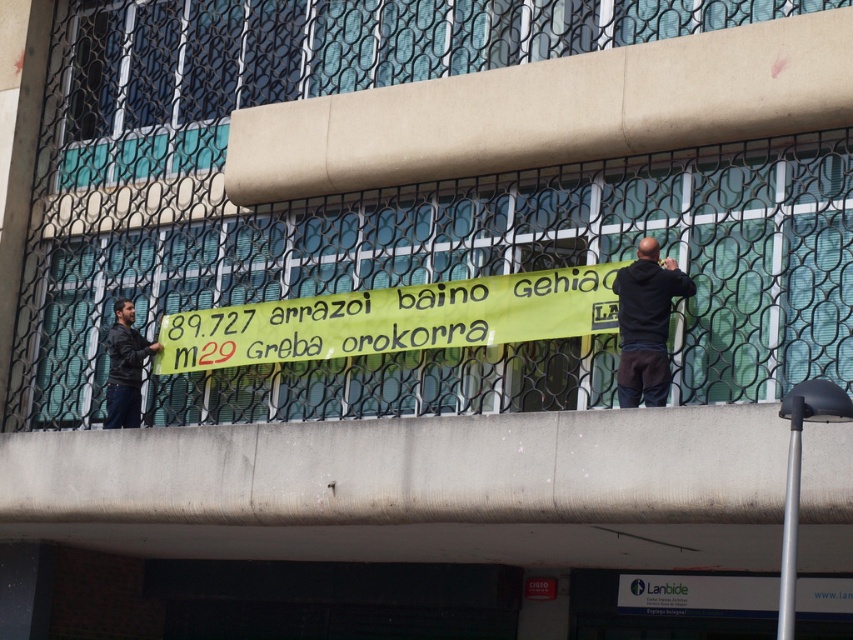
Looking at this image, which is above, green mesh fence at center or dark gray jacket at left?

green mesh fence at center is higher up.

This screenshot has height=640, width=853. In order to click on green mesh fence at center in this screenshot , I will do `click(402, 188)`.

Between point (151, 86) and point (109, 392), which one is positioned in front?

Point (109, 392) is more forward.

Where is `green mesh fence at center`? The width and height of the screenshot is (853, 640). green mesh fence at center is located at coordinates (402, 188).

Is point (320, 365) more distant than point (312, 336)?

Yes, point (320, 365) is behind point (312, 336).

Can you confirm if green mesh fence at center is shorter than yellow fabric banner at center?

Incorrect, green mesh fence at center's height does not fall short of yellow fabric banner at center's.

Where is `green mesh fence at center`? The height and width of the screenshot is (640, 853). green mesh fence at center is located at coordinates (402, 188).

What do you see at coordinates (402, 188) in the screenshot?
I see `green mesh fence at center` at bounding box center [402, 188].

Who is taller, green mesh fence at center or black hoodie at right?

With more height is green mesh fence at center.

Is point (827, 192) positioned in front of point (657, 301)?

Yes, point (827, 192) is closer to viewer.

This screenshot has width=853, height=640. I want to click on green mesh fence at center, so (402, 188).